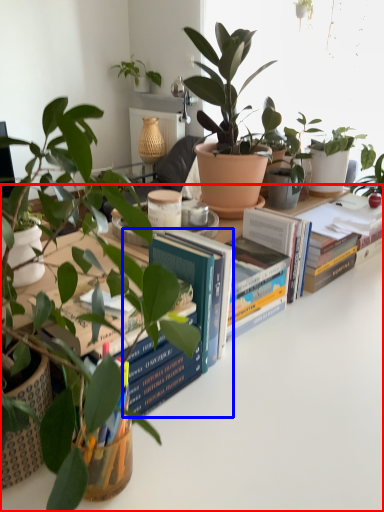
Question: Which point is further to the camera, table (highlighted by a red box) or paperback book (highlighted by a blue box)?

Choices:
 (A) table
 (B) paperback book

Answer: (B)